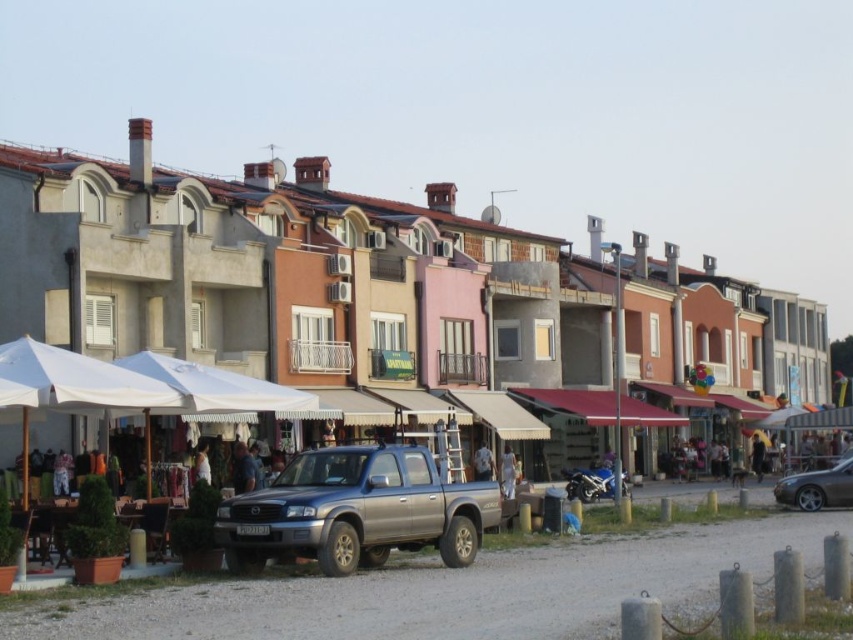
Question: Does metallic silver truck at lower center have a lesser width compared to satin metallic pickup truck at center?

Choices:
 (A) no
 (B) yes

Answer: (A)

Question: Can you confirm if metallic silver truck at lower center is positioned to the left of satin metallic pickup truck at center?

Choices:
 (A) no
 (B) yes

Answer: (A)

Question: Which object is farther from the camera taking this photo?

Choices:
 (A) shiny silver sedan at lower right
 (B) metallic silver truck at lower center

Answer: (A)

Question: Is metallic silver truck at lower center to the right of shiny silver sedan at lower right from the viewer's perspective?

Choices:
 (A) no
 (B) yes

Answer: (A)

Question: Which object is the farthest from the satin metallic pickup truck at center?

Choices:
 (A) metallic silver truck at lower center
 (B) shiny silver sedan at lower right

Answer: (B)

Question: Among these objects, which one is farthest from the camera?

Choices:
 (A) shiny silver sedan at lower right
 (B) metallic silver truck at lower center

Answer: (A)